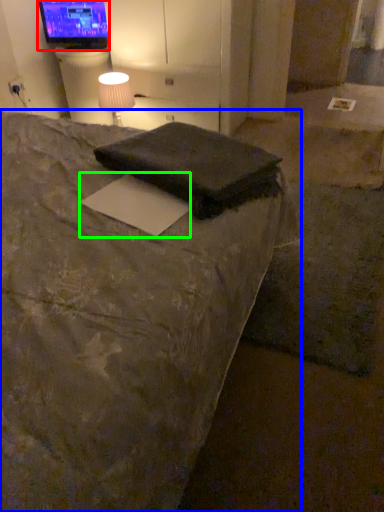
Question: Which object is positioned farthest from television (highlighted by a red box)? Select from bed (highlighted by a blue box) and paper (highlighted by a green box).

Choices:
 (A) bed
 (B) paper

Answer: (B)